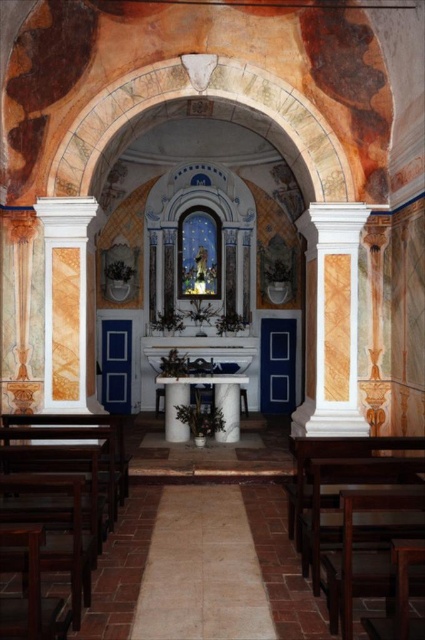
You are standing in the chapel and want to place a small candle on the floor near the white marble column at right. Based on its position, where should you look to find the column?

The white marble column at right is located at point 0.502 in the x coordinate and 0.781 in the y coordinate, so you should look towards the lower right area of the chapel to find it.

You are an interior designer planning to place a large decorative vase between the white marble column at right and the white marble column at left. Which column should the vase be closer to if you want it centered between them?

The white marble column at right is larger in size than the white marble column at left, so to center the vase between them, it should be closer to the smaller column at left to account for the size difference.